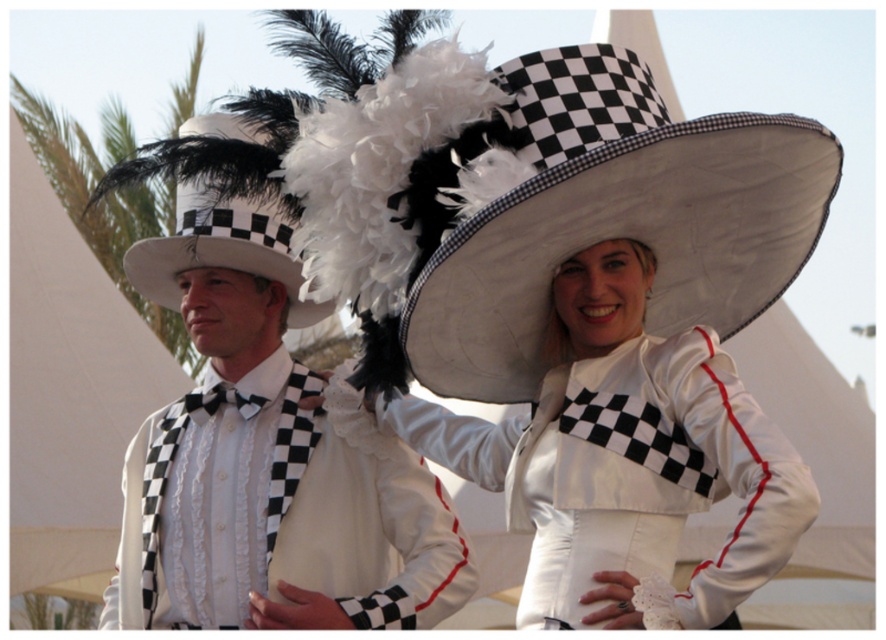
You are a photographer adjusting your camera to capture the two people in the scene. You notice a point at coordinates [626,458]. What object is located at this point?

The point at coordinates [626,458] corresponds to the satin white hat at upper center.